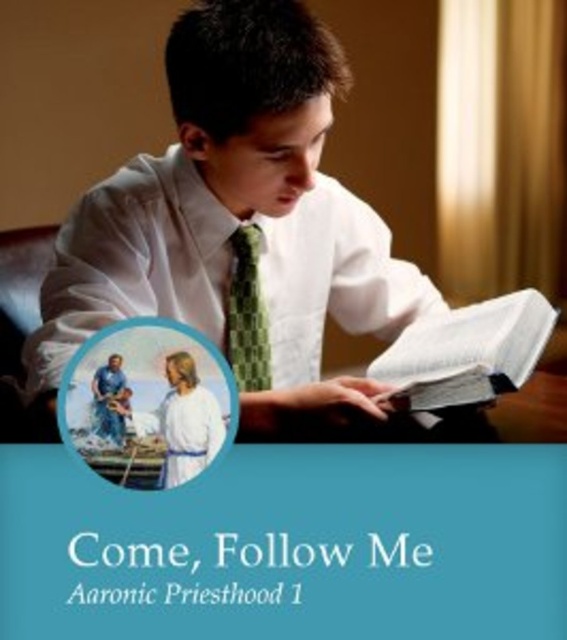
Question: Which point is farther to the camera?

Choices:
 (A) white smooth shirt at center
 (B) white paper book at center

Answer: (B)

Question: Which point is closer to the camera?

Choices:
 (A) coord(259,358)
 (B) coord(535,317)

Answer: (B)

Question: Is blue paper at bottom wider than white smooth shirt at center?

Choices:
 (A) yes
 (B) no

Answer: (A)

Question: Among these points, which one is farthest from the camera?

Choices:
 (A) (150, 260)
 (B) (462, 330)
 (C) (252, 353)

Answer: (C)

Question: Can you confirm if white paper book at center is positioned above green checkered tie at center?

Choices:
 (A) no
 (B) yes

Answer: (A)

Question: Is blue paper at bottom positioned behind white paper book at center?

Choices:
 (A) no
 (B) yes

Answer: (A)